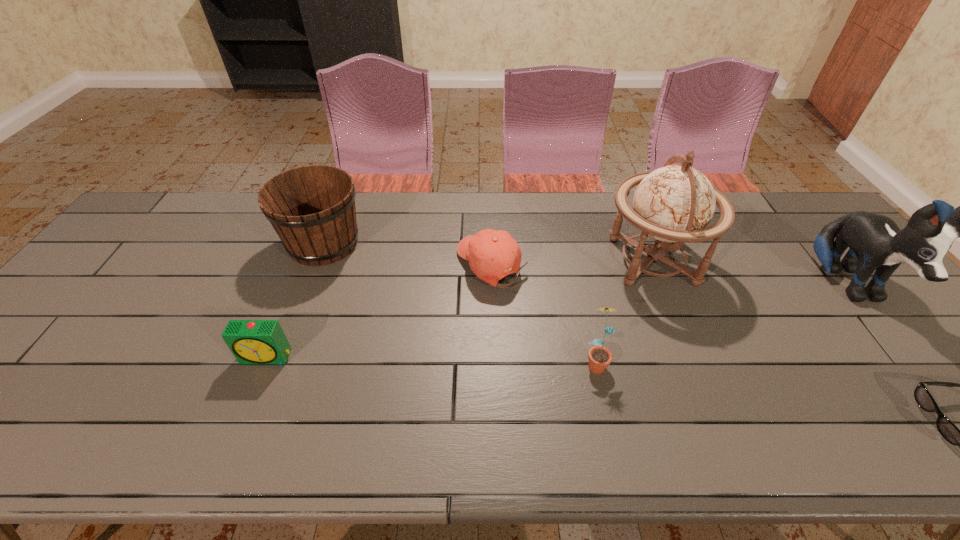
At what (x,y) coordinates should I click in order to perform the action: click on globe. Please return your answer as a coordinate pair (x, y). This screenshot has height=540, width=960. Looking at the image, I should click on (674, 203).

The width and height of the screenshot is (960, 540). I want to click on puppy, so click(x=875, y=242).

Where is `wine bucket`? The width and height of the screenshot is (960, 540). wine bucket is located at coordinates (312, 208).

Identify the location of sunflower. Image resolution: width=960 pixels, height=540 pixels. (600, 357).

Where is `the third object from left to right`? the third object from left to right is located at coordinates (480, 249).

Find the location of a particular element. alarm clock is located at coordinates (252, 342).

Locate an element on the screen. This screenshot has height=540, width=960. vacant region located 0.300m on the front-facing side of the fifth object from left to right is located at coordinates (499, 261).

Find the location of a particular element. This screenshot has width=960, height=540. vacant space located on the front-facing side of the fifth object from left to right is located at coordinates (564, 261).

Locate an element on the screen. vacant area situated 0.160m on the front-facing side of the fifth object from left to right is located at coordinates (547, 261).

The image size is (960, 540). Find the location of `vacant region located on the front-facing side of the puppy`. vacant region located on the front-facing side of the puppy is located at coordinates pyautogui.click(x=944, y=405).